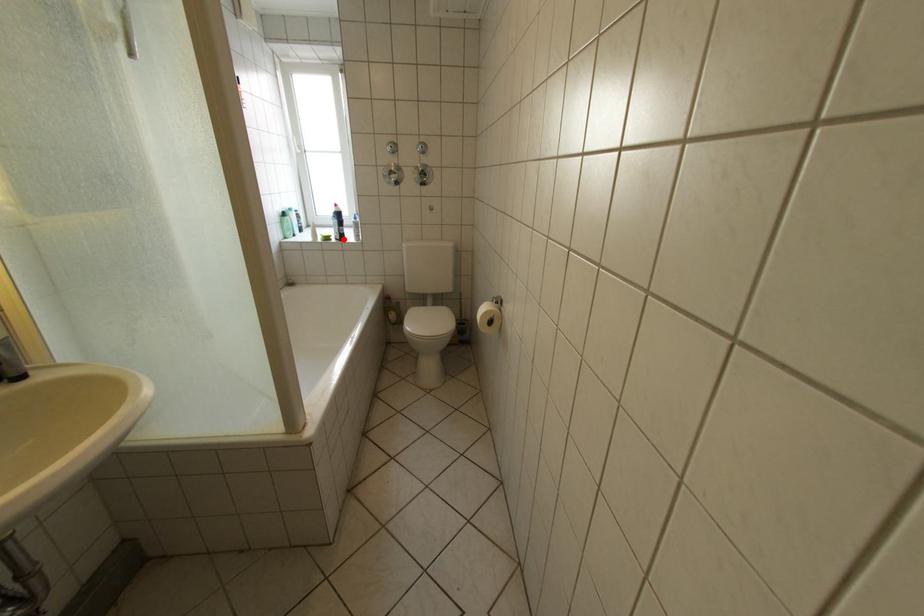
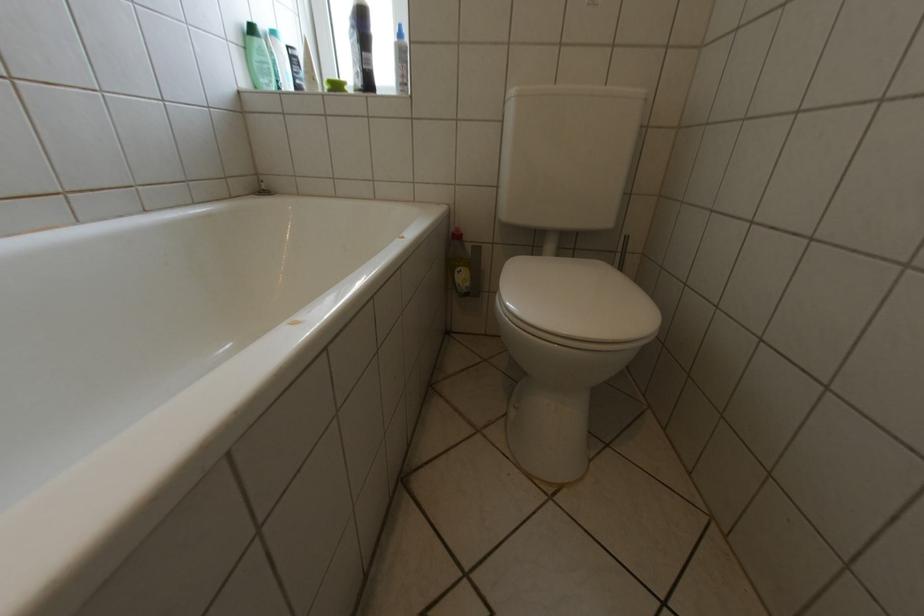
The point at the highlighted location is marked in the first image. Where is the corresponding point in the second image?

(359, 90)